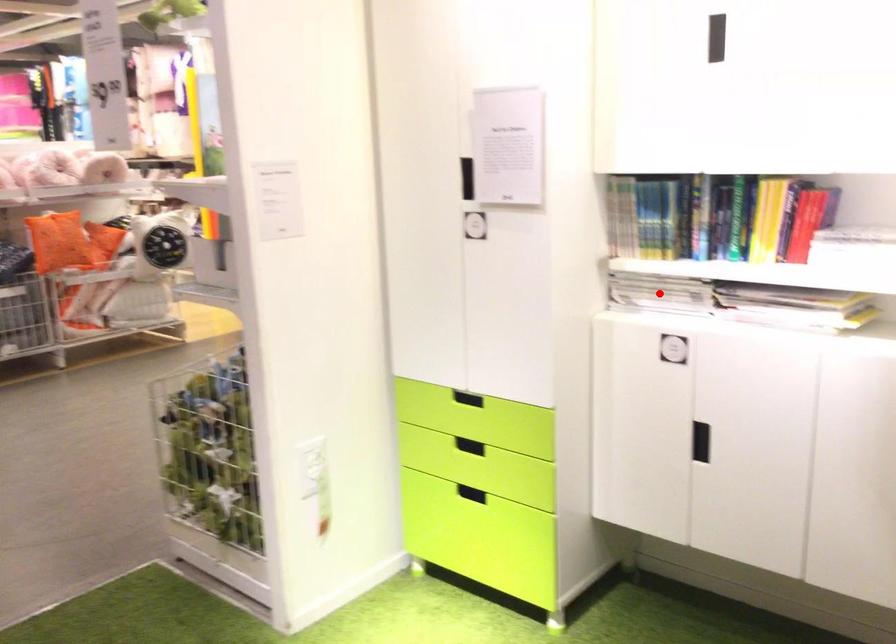
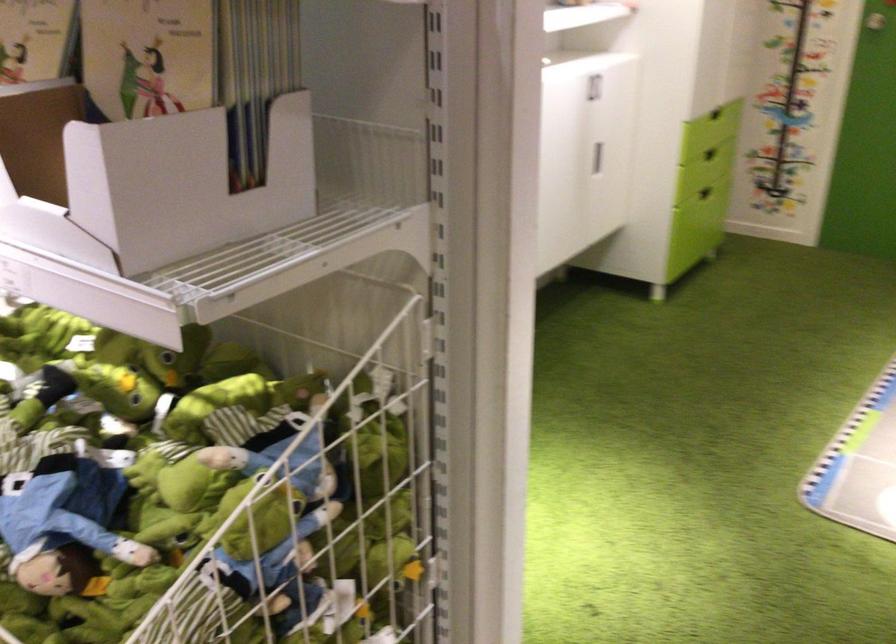
Question: I am providing you with two images of the same scene from different viewpoints. A red point is marked on the first image. Can you still see the location of the red point in image 2?

Choices:
 (A) Yes
 (B) No

Answer: (B)